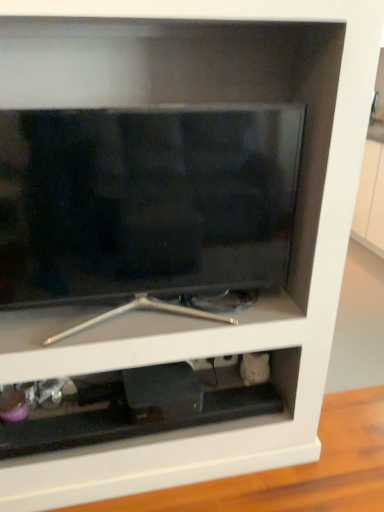
Question: Does matte black tv at center have a greater width compared to black plastic cabinet at lower center?

Choices:
 (A) yes
 (B) no

Answer: (B)

Question: From the image's perspective, is matte black tv at center under black plastic cabinet at lower center?

Choices:
 (A) yes
 (B) no

Answer: (B)

Question: Would you say matte black tv at center contains black plastic cabinet at lower center?

Choices:
 (A) no
 (B) yes

Answer: (A)

Question: Does matte black tv at center have a lesser width compared to black plastic cabinet at lower center?

Choices:
 (A) yes
 (B) no

Answer: (A)

Question: From a real-world perspective, is matte black tv at center physically below black plastic cabinet at lower center?

Choices:
 (A) yes
 (B) no

Answer: (B)

Question: Is matte black tv at center touching black plastic cabinet at lower center?

Choices:
 (A) no
 (B) yes

Answer: (A)

Question: Does black plastic cabinet at lower center appear on the left side of matte black tv at center?

Choices:
 (A) yes
 (B) no

Answer: (A)

Question: Is black plastic cabinet at lower center to the right of matte black tv at center from the viewer's perspective?

Choices:
 (A) yes
 (B) no

Answer: (B)

Question: Considering the relative sizes of black plastic cabinet at lower center and matte black tv at center in the image provided, is black plastic cabinet at lower center smaller than matte black tv at center?

Choices:
 (A) yes
 (B) no

Answer: (A)

Question: From a real-world perspective, does black plastic cabinet at lower center stand above matte black tv at center?

Choices:
 (A) no
 (B) yes

Answer: (A)

Question: From the image's perspective, is black plastic cabinet at lower center on matte black tv at center?

Choices:
 (A) no
 (B) yes

Answer: (A)

Question: Is black plastic cabinet at lower center facing towards matte black tv at center?

Choices:
 (A) yes
 (B) no

Answer: (B)

Question: From the image's perspective, is matte black tv at center positioned above or below black plastic cabinet at lower center?

Choices:
 (A) above
 (B) below

Answer: (A)